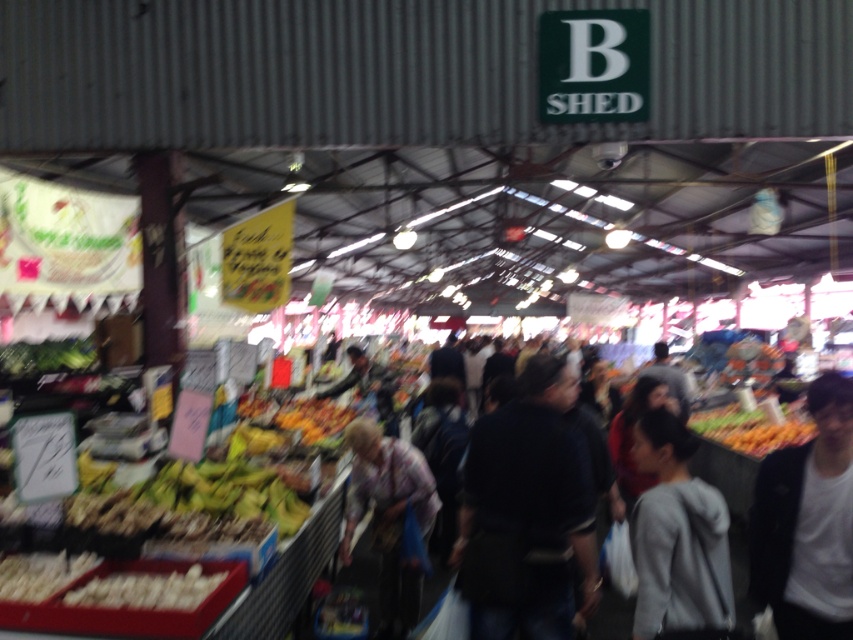
Question: Where is gray hoodie at lower right located in relation to plaid shirt at center in the image?

Choices:
 (A) left
 (B) right

Answer: (B)

Question: Which object appears farthest from the camera in this image?

Choices:
 (A) dark gray hoodie at center
 (B) dark blue shirt at center
 (C) white matte jacket at lower right
 (D) plaid shirt at center

Answer: (A)

Question: Does white matte jacket at lower right appear on the left side of gray hoodie at lower right?

Choices:
 (A) no
 (B) yes

Answer: (A)

Question: Is gray hoodie at lower right below dark gray hoodie at center?

Choices:
 (A) no
 (B) yes

Answer: (A)

Question: Considering the real-world distances, which object is closest to the plaid shirt at center?

Choices:
 (A) white matte jacket at lower right
 (B) gray hoodie at lower right
 (C) dark gray hoodie at center

Answer: (B)

Question: Among these objects, which one is nearest to the camera?

Choices:
 (A) dark gray hoodie at center
 (B) dark blue shirt at center
 (C) white matte jacket at lower right
 (D) gray hoodie at lower right

Answer: (D)